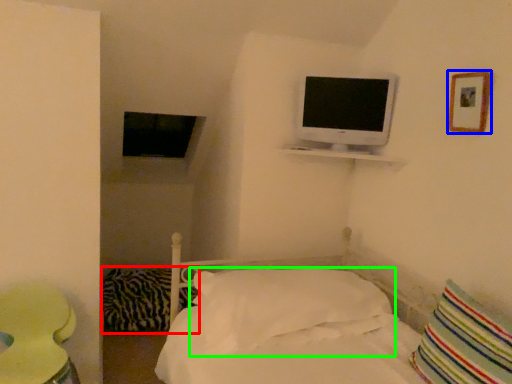
Question: Estimate the real-world distances between objects in this image. Which object is farther from pillow (highlighted by a red box), picture frame (highlighted by a blue box) or pillow (highlighted by a green box)?

Choices:
 (A) picture frame
 (B) pillow

Answer: (A)